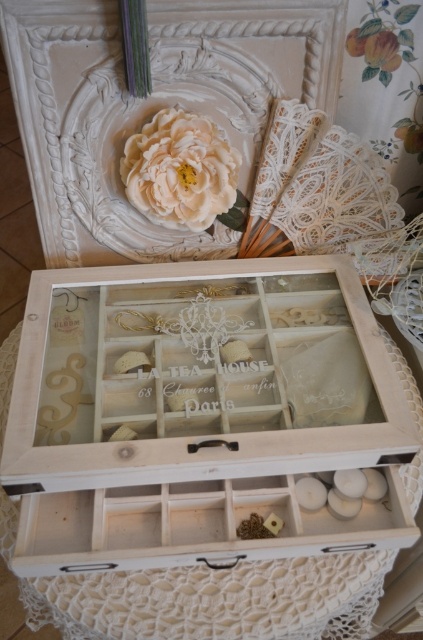
Is white wood drawer at center smaller than creamy matte flower at upper center?

No.

Identify the location of white wood drawer at center. This screenshot has height=640, width=423. (192, 525).

Find the location of `white wood drawer at center`. white wood drawer at center is located at coordinates (192, 525).

Does point (49, 276) come closer to viewer compared to point (178, 518)?

That is False.

Image resolution: width=423 pixels, height=640 pixels. Find the location of `white wood box at center`. white wood box at center is located at coordinates (187, 417).

Measure the distance between white wood box at center and creamy matte flower at upper center.

white wood box at center is 12.40 inches from creamy matte flower at upper center.

Is white wood box at center to the right of creamy matte flower at upper center from the viewer's perspective?

Indeed, white wood box at center is positioned on the right side of creamy matte flower at upper center.

Who is more distant from viewer, (164, 492) or (197, 163)?

The point (197, 163) is more distant.

Where is `white wood box at center`? Image resolution: width=423 pixels, height=640 pixels. white wood box at center is located at coordinates (187, 417).